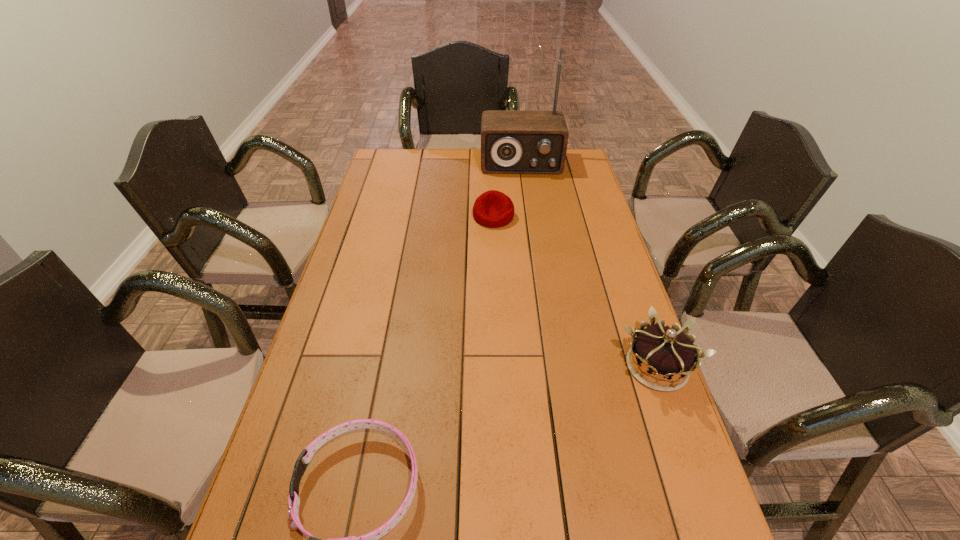
This screenshot has width=960, height=540. I want to click on free space on the desktop that is between the nearest object and the third farthest object and is positioned on the seat area of the second shortest object, so click(524, 421).

Identify the location of vacant space on the desktop that is between the shortest object and the second tallest object and is positioned on the front-facing side of the farthest object. pyautogui.click(x=544, y=413).